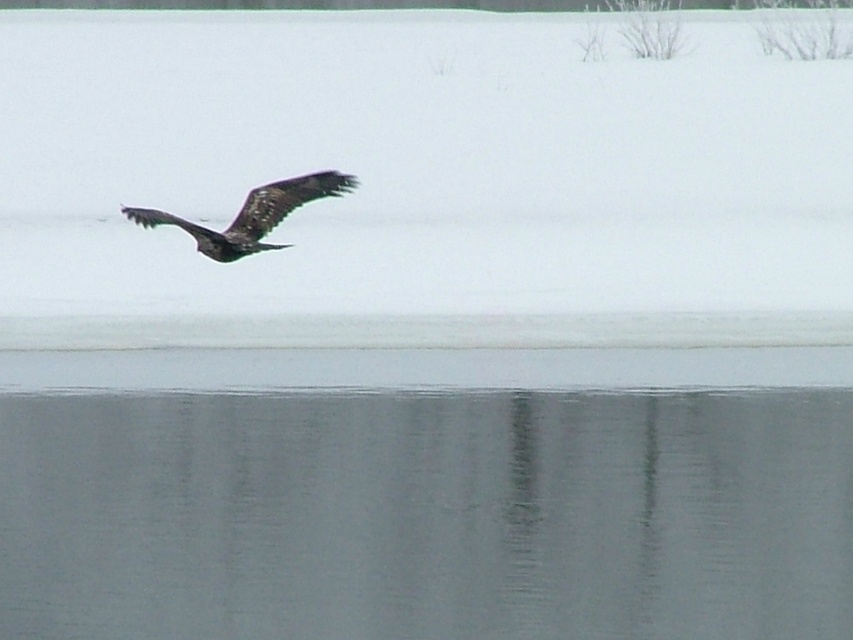
Does white fluffy snow at upper center appear on the left side of dark brown feathers at center?

No, white fluffy snow at upper center is not to the left of dark brown feathers at center.

Is white fluffy snow at upper center below dark brown feathers at center?

No, white fluffy snow at upper center is not below dark brown feathers at center.

Is point (125, 259) positioned behind point (299, 177)?

Yes, point (125, 259) is behind point (299, 177).

Identify the location of white fluffy snow at upper center. Image resolution: width=853 pixels, height=640 pixels. (419, 180).

Who is positioned more to the right, smooth gray water at lower center or dark brown feathers at center?

From the viewer's perspective, smooth gray water at lower center appears more on the right side.

Is smooth gray water at lower center positioned in front of dark brown feathers at center?

No, smooth gray water at lower center is behind dark brown feathers at center.

Locate an element on the screen. The image size is (853, 640). smooth gray water at lower center is located at coordinates (426, 515).

Is white fluffy snow at upper center thinner than smooth gray water at lower center?

No.

Between white fluffy snow at upper center and smooth gray water at lower center, which one appears on the right side from the viewer's perspective?

smooth gray water at lower center

Between point (527, 205) and point (564, 449), which one is positioned behind?

The point (527, 205) is behind.

You are a GUI agent. You are given a task and a screenshot of the screen. Output one action in this format:
    pyautogui.click(x=<x>, y=<y>)
    Task: Click on the white fluffy snow at upper center
    The width and height of the screenshot is (853, 640).
    Given the screenshot: What is the action you would take?
    pyautogui.click(x=419, y=180)